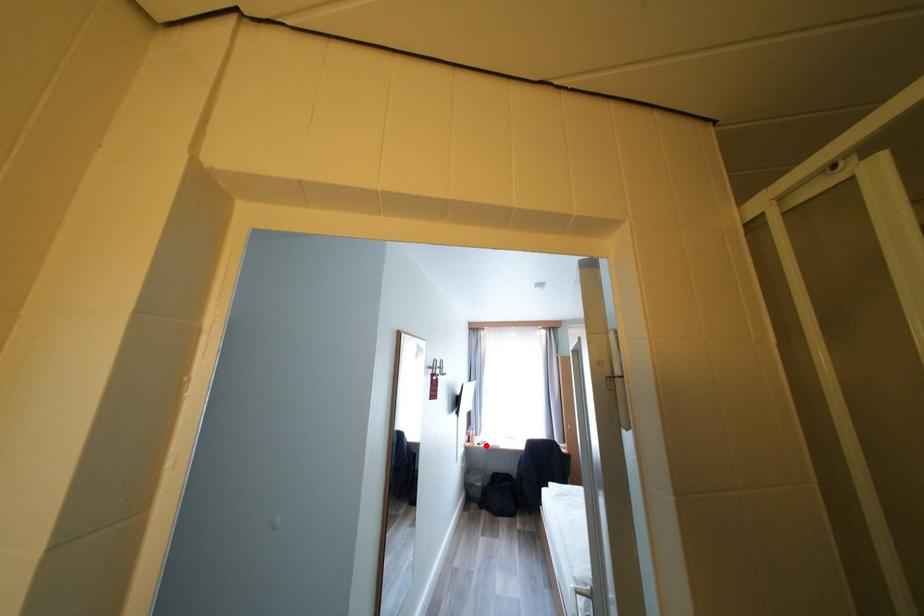
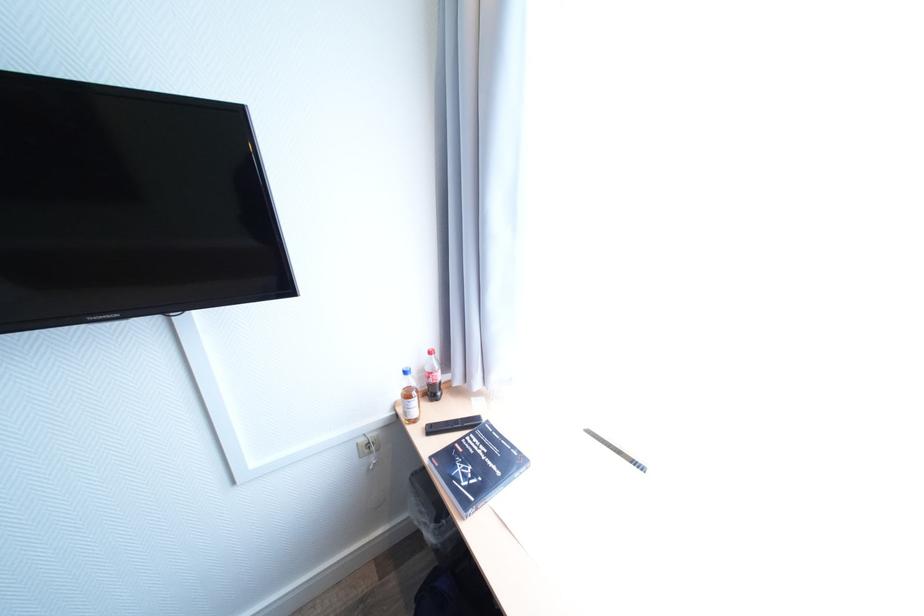
Question: I am providing you with two images of the same scene from different viewpoints. Image1 has a red point marked. In image2, the corresponding 3D location appears at what relative position? Reply with the corresponding letter.

Choices:
 (A) Closer
 (B) Farther

Answer: (A)